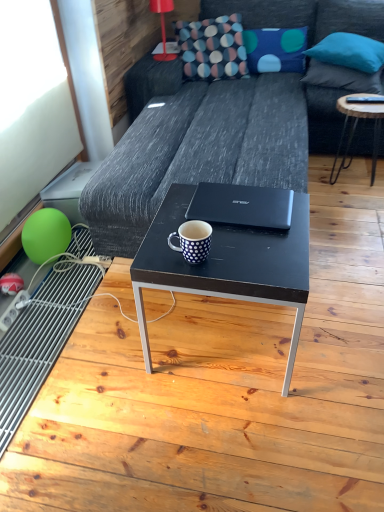
This screenshot has width=384, height=512. Identify the location of free space above black matte coffee table at center (from a real-world perspective). (240, 229).